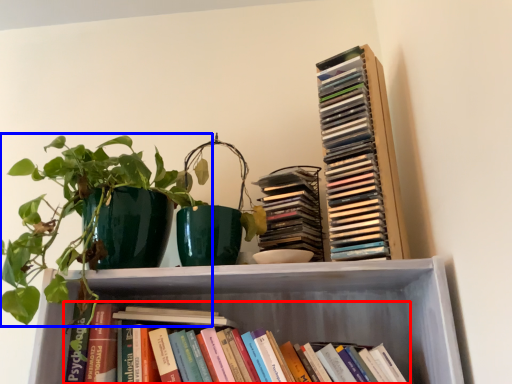
Question: Which object is closer to the camera taking this photo, book (highlighted by a red box) or houseplant (highlighted by a blue box)?

Choices:
 (A) book
 (B) houseplant

Answer: (B)